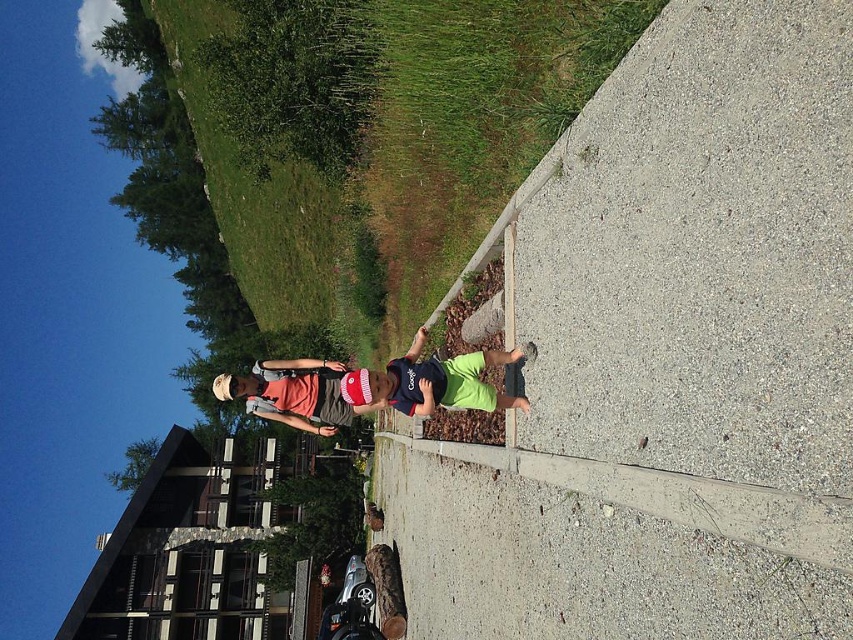
Consider the image. You are a photographer positioned to the side of the scene. You want to capture a clear photo of the dark blue jersey at center and the matte red cap at center. Which object should you focus on first to ensure both are in focus?

The dark blue jersey at center is above the matte red cap at center, so focusing on the dark blue jersey at center first will help ensure both are in focus since it is closer to the camera.

You are standing on the paved area and want to place a small bench exactly at the center of the gray concrete at center. According to the scene description, where should you place the bench in terms of coordinates?

The bench should be placed at the coordinates point (x=663, y=358) as that is the 2D location of the gray concrete at center.